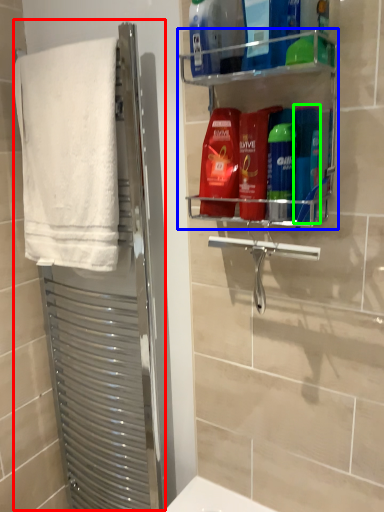
Question: Which object is positioned closest to screen door (highlighted by a red box)? Select from shelf (highlighted by a blue box) and toiletry (highlighted by a green box).

Choices:
 (A) shelf
 (B) toiletry

Answer: (A)